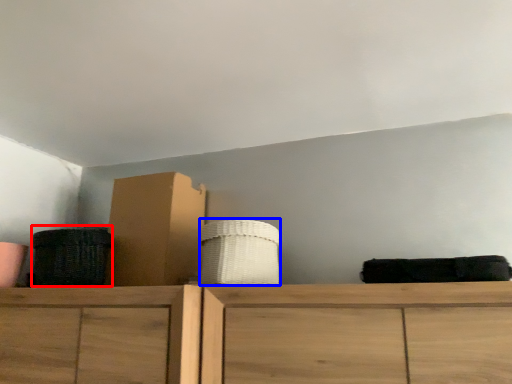
Question: Which of the following is the closest to the observer, basket (highlighted by a red box) or basket (highlighted by a blue box)?

Choices:
 (A) basket
 (B) basket

Answer: (B)